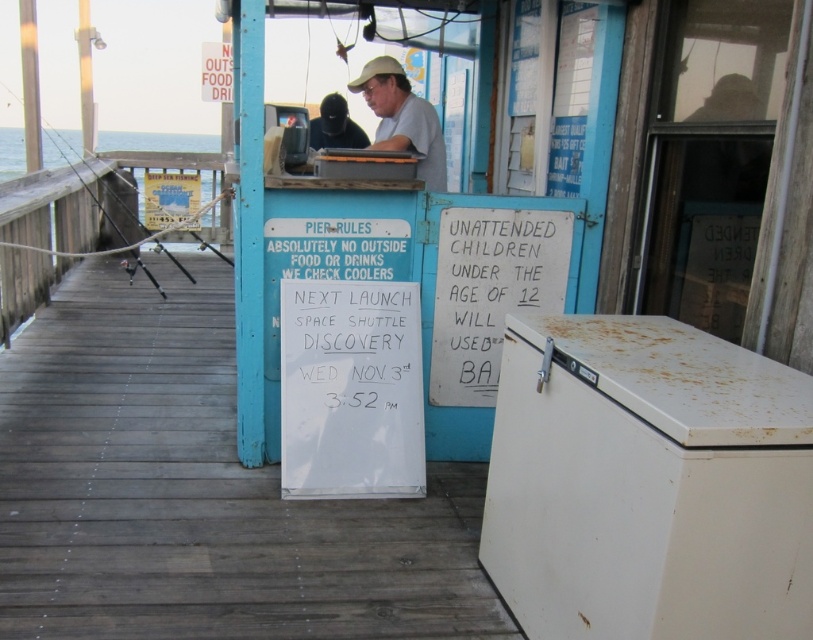
Question: Can you confirm if white matte cooler at right is bigger than matte khaki hat at upper center?

Choices:
 (A) no
 (B) yes

Answer: (B)

Question: Estimate the real-world distances between objects in this image. Which object is farther from the matte black jacket at upper center?

Choices:
 (A) black plastic fishing pole at left
 (B) white matte cooler at right
 (C) white wood dock at center

Answer: (A)

Question: Is white wood dock at center wider than black plastic fishing pole at left?

Choices:
 (A) yes
 (B) no

Answer: (B)

Question: Considering the real-world distances, which object is farthest from the matte khaki hat at upper center?

Choices:
 (A) matte black jacket at upper center
 (B) white matte cooler at right
 (C) black plastic fishing pole at left
 (D) white wood dock at center

Answer: (C)

Question: Which of the following is the closest to the observer?

Choices:
 (A) (807, 490)
 (B) (98, 204)
 (C) (402, 132)
 (D) (344, 140)

Answer: (A)

Question: Can you confirm if white wood dock at center is wider than matte khaki hat at upper center?

Choices:
 (A) yes
 (B) no

Answer: (A)